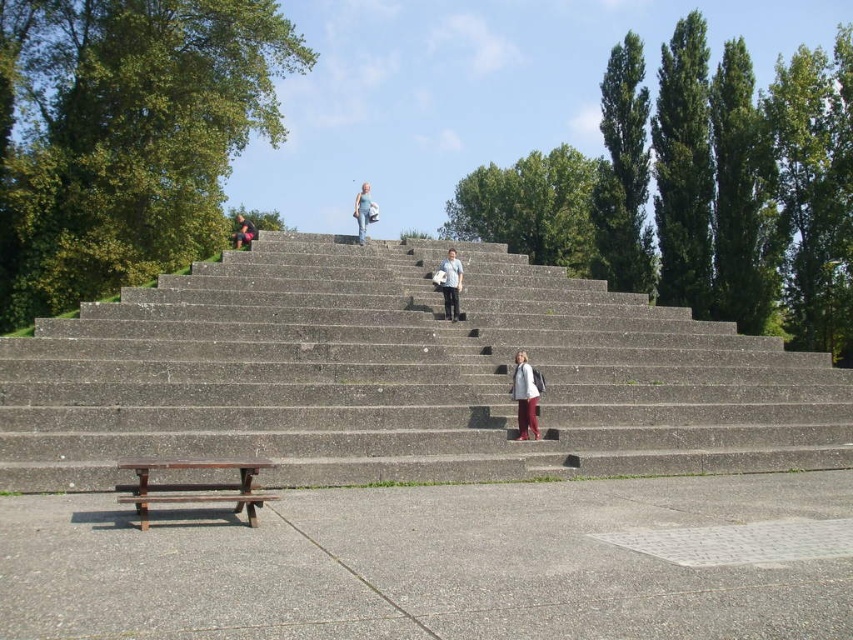
You are standing on the paved area near the wooden bench and want to place a matte white jacket at center. The concrete stairs at center are in your way. Can you move the jacket to the desired location without stepping on the stairs?

The concrete stairs at center is positioned over matte white jacket at center, so you cannot move the jacket to the desired location without stepping on the stairs.

You are a photographer setting up a tripod in the open outdoor space. You need to place the tripod between the matte white jacket at center and the denim jeans at upper center. Considering their thickness, which object should the tripod be closer to?

The matte white jacket at center is thinner than the denim jeans at upper center, so the tripod should be placed closer to the denim jeans at upper center to ensure stability and balance.

From the picture: You are standing on the paved area near the wooden bench and want to walk up the concrete stairs at center while carrying a matte white jacket at center. Since you need to keep the jacket away from the stairs, can you estimate if the stairs are wider than the jacket?

The concrete stairs at center are wider than the matte white jacket at center, so yes, the stairs are wider than the jacket.